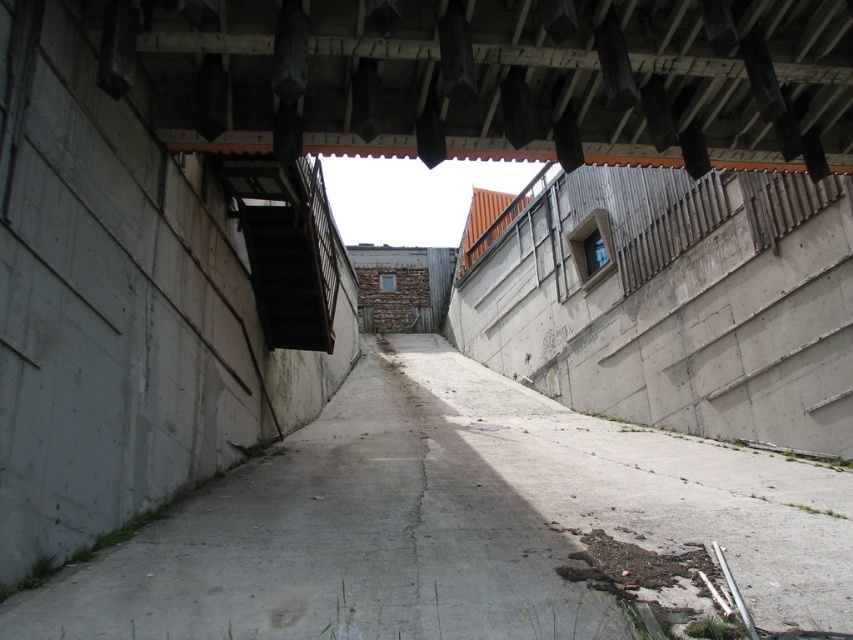
Between concrete at center and dark gray concrete stairs at upper left, which one appears on the left side from the viewer's perspective?

dark gray concrete stairs at upper left

Is concrete at center smaller than dark gray concrete stairs at upper left?

Incorrect, concrete at center is not smaller in size than dark gray concrete stairs at upper left.

This screenshot has width=853, height=640. Identify the location of concrete at center. (454, 524).

The image size is (853, 640). What are the coordinates of `concrete at center` in the screenshot? It's located at (454, 524).

Is concrete ceiling at upper center in front of dark gray concrete stairs at upper left?

Yes, concrete ceiling at upper center is closer to the viewer.

Is concrete ceiling at upper center bigger than dark gray concrete stairs at upper left?

No, concrete ceiling at upper center is not bigger than dark gray concrete stairs at upper left.

Does point (413, 8) lie behind point (335, 289)?

No, (413, 8) is closer to viewer.

This screenshot has height=640, width=853. What are the coordinates of `concrete ceiling at upper center` in the screenshot? It's located at (496, 76).

Is point (347, 400) positioned before point (155, 35)?

No.

Can you confirm if concrete at center is positioned below concrete ceiling at upper center?

Indeed, concrete at center is positioned under concrete ceiling at upper center.

Describe the element at coordinates (454, 524) in the screenshot. I see `concrete at center` at that location.

Locate an element on the screen. This screenshot has height=640, width=853. concrete at center is located at coordinates (454, 524).